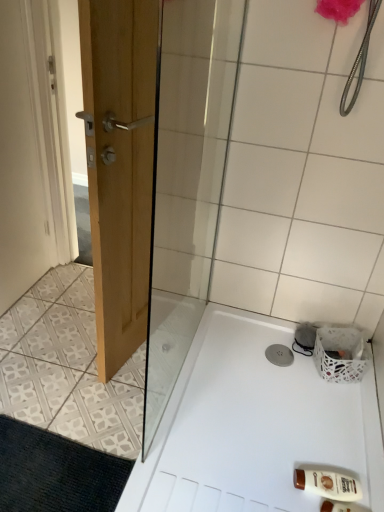
Question: Is black textured bath mat at lower left not within white woven basket at lower right?

Choices:
 (A) yes
 (B) no

Answer: (A)

Question: Is black textured bath mat at lower left closer to the viewer compared to white woven basket at lower right?

Choices:
 (A) yes
 (B) no

Answer: (A)

Question: Is black textured bath mat at lower left in contact with white woven basket at lower right?

Choices:
 (A) no
 (B) yes

Answer: (A)

Question: Is black textured bath mat at lower left positioned far away from white woven basket at lower right?

Choices:
 (A) no
 (B) yes

Answer: (B)

Question: Is black textured bath mat at lower left further to camera compared to white woven basket at lower right?

Choices:
 (A) no
 (B) yes

Answer: (A)

Question: Is black textured bath mat at lower left smaller than white woven basket at lower right?

Choices:
 (A) no
 (B) yes

Answer: (B)

Question: Is black textured bath mat at lower left wider than brown plastic bottle at lower right?

Choices:
 (A) no
 (B) yes

Answer: (B)

Question: Can you confirm if black textured bath mat at lower left is positioned to the right of brown plastic bottle at lower right?

Choices:
 (A) yes
 (B) no

Answer: (B)

Question: From a real-world perspective, is black textured bath mat at lower left located beneath brown plastic bottle at lower right?

Choices:
 (A) yes
 (B) no

Answer: (A)

Question: Considering the relative sizes of black textured bath mat at lower left and brown plastic bottle at lower right in the image provided, is black textured bath mat at lower left thinner than brown plastic bottle at lower right?

Choices:
 (A) no
 (B) yes

Answer: (A)

Question: Is brown plastic bottle at lower right completely or partially inside black textured bath mat at lower left?

Choices:
 (A) no
 (B) yes

Answer: (A)

Question: Is black textured bath mat at lower left to the left of brown plastic bottle at lower right from the viewer's perspective?

Choices:
 (A) no
 (B) yes

Answer: (B)

Question: Are brown plastic bottle at lower right and black textured bath mat at lower left far apart?

Choices:
 (A) yes
 (B) no

Answer: (B)